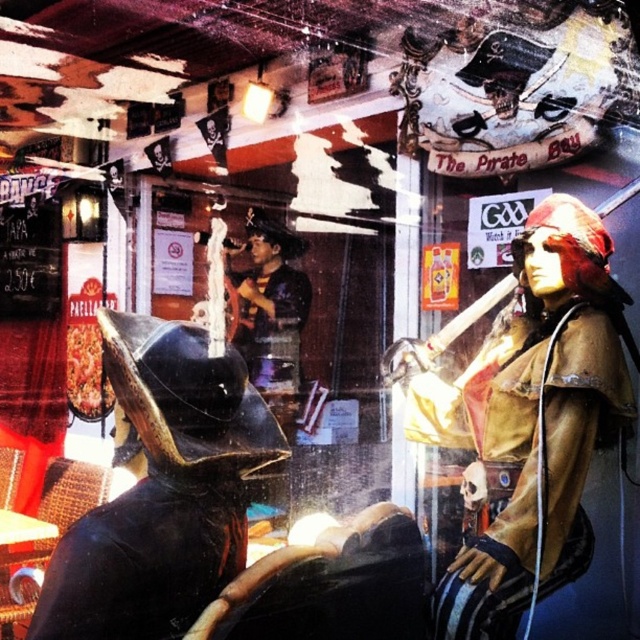
Does gold metallic pirate at center have a greater height compared to shiny black helmet at left?

Indeed, gold metallic pirate at center has a greater height compared to shiny black helmet at left.

Can you confirm if gold metallic pirate at center is positioned to the left of shiny black helmet at left?

In fact, gold metallic pirate at center is to the right of shiny black helmet at left.

Does point (536, 218) come behind point (77, 621)?

Yes, it is.

Find the location of a particular element. The image size is (640, 640). gold metallic pirate at center is located at coordinates (544, 420).